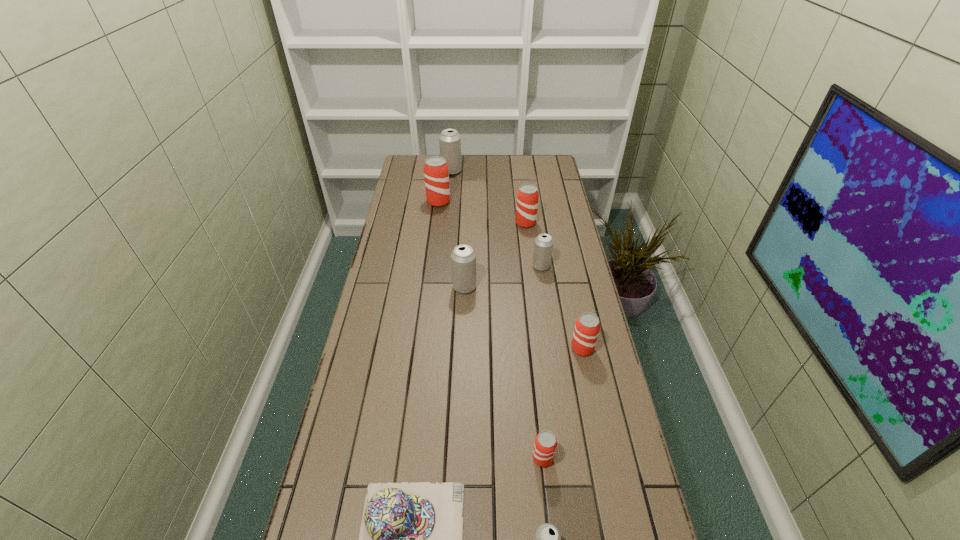
Locate which object is the sixth closest to the seventh farthest beer can. Please provide its 2D coordinates. Your answer should be formatted as a tuple, i.e. [(x, y)], where the tuple contains the x and y coordinates of a point satisfying the conditions above.

[(527, 196)]

At what (x,y) coordinates should I click in order to perform the action: click on object that stands as the fifth closest to the third farthest white beer can. Please return your answer as a coordinate pair (x, y). The image size is (960, 540). Looking at the image, I should click on (545, 445).

Locate an element on the screen. beer can that is the seventh closest to the sixth farthest beer can is located at coordinates (449, 140).

What are the coordinates of `beer can that is the fifth nearest to the third farthest white beer can` in the screenshot? It's located at (545, 445).

Point out which white beer can is positioned as the fourth nearest to the cap. Please provide its 2D coordinates. Your answer should be formatted as a tuple, i.e. [(x, y)], where the tuple contains the x and y coordinates of a point satisfying the conditions above.

[(449, 140)]

Select which white beer can appears as the third closest to the third farthest white beer can. Please provide its 2D coordinates. Your answer should be formatted as a tuple, i.e. [(x, y)], where the tuple contains the x and y coordinates of a point satisfying the conditions above.

[(547, 539)]

Locate which orange beer can is the closest to the seventh farthest beer can. Please provide its 2D coordinates. Your answer should be formatted as a tuple, i.e. [(x, y)], where the tuple contains the x and y coordinates of a point satisfying the conditions above.

[(587, 327)]

Locate an element on the screen. This screenshot has height=540, width=960. orange beer can identified as the second closest to the fourth nearest beer can is located at coordinates point(587,327).

At what (x,y) coordinates should I click in order to perform the action: click on vacant space that satisfies the following two spatial constraints: 1. on the front side of the third biggest orange beer can; 2. on the right side of the rightmost white beer can. Please return your answer as a coordinate pair (x, y). The width and height of the screenshot is (960, 540). Looking at the image, I should click on (554, 348).

In order to click on free space that satisfies the following two spatial constraints: 1. on the front side of the fifth farthest beer can; 2. on the left side of the seventh nearest beer can in this screenshot , I will do `click(428, 287)`.